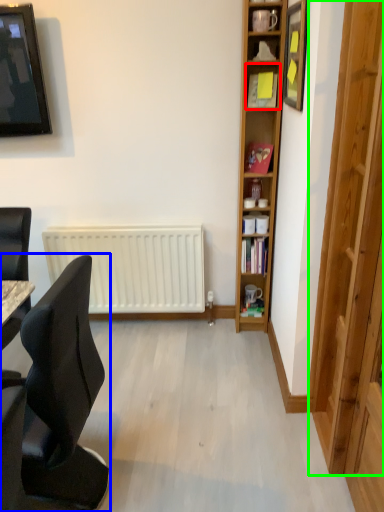
Question: Considering the real-world distances, which object is closest to shelf (highlighted by a red box)? chair (highlighted by a blue box) or glass door (highlighted by a green box).

Choices:
 (A) chair
 (B) glass door

Answer: (B)